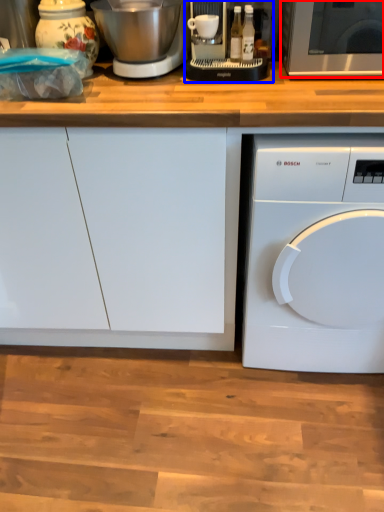
Question: Which object appears farthest to the camera in this image, microwave oven (highlighted by a red box) or food processor (highlighted by a blue box)?

Choices:
 (A) microwave oven
 (B) food processor

Answer: (B)